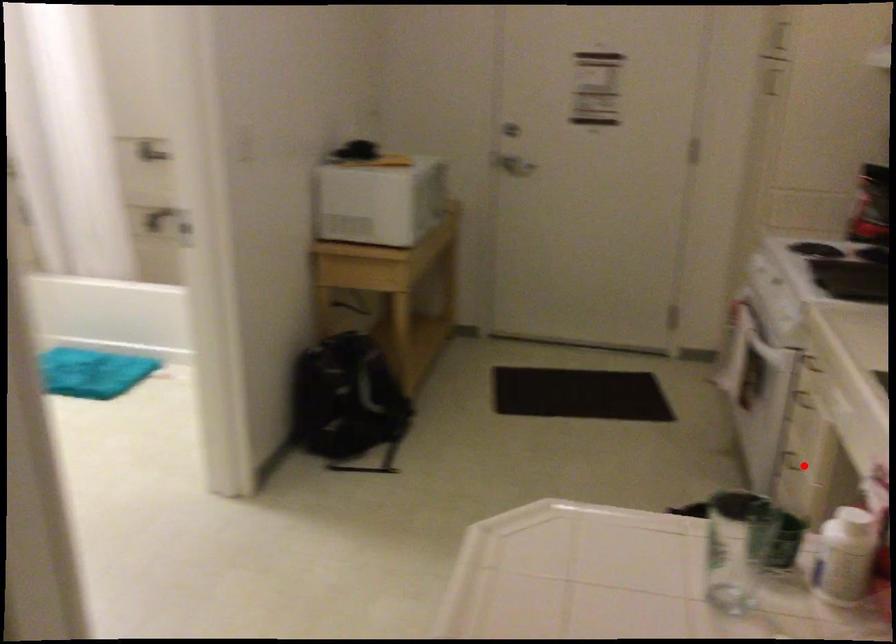
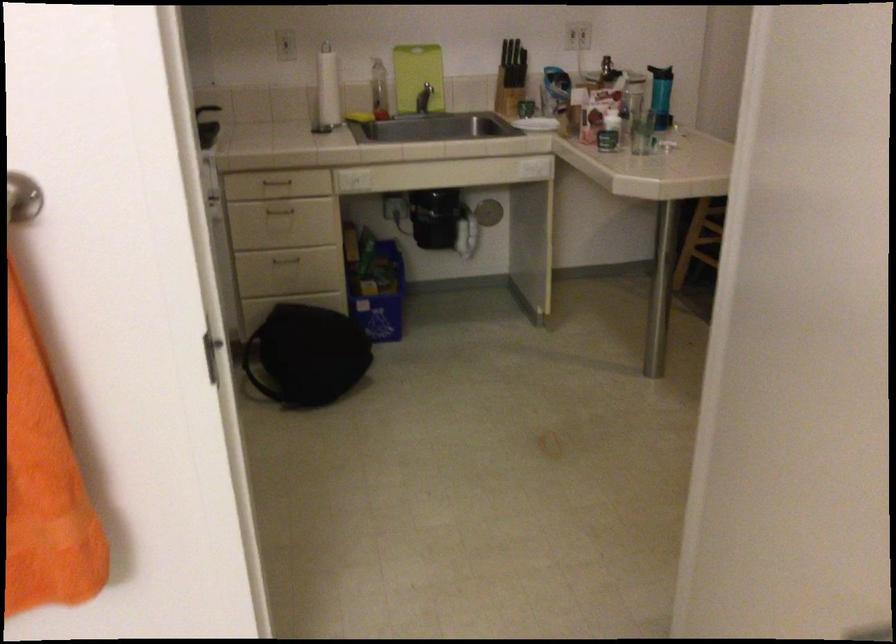
The point at the highlighted location is marked in the first image. Where is the corresponding point in the second image?

(287, 261)